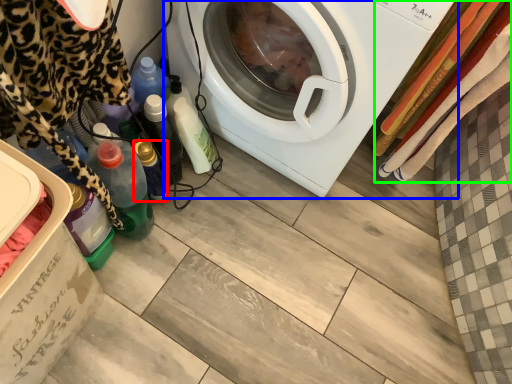
Question: Which is farther away from bottle (highlighted by a red box)? washing machine (highlighted by a blue box) or blanket (highlighted by a green box)?

Choices:
 (A) washing machine
 (B) blanket

Answer: (B)